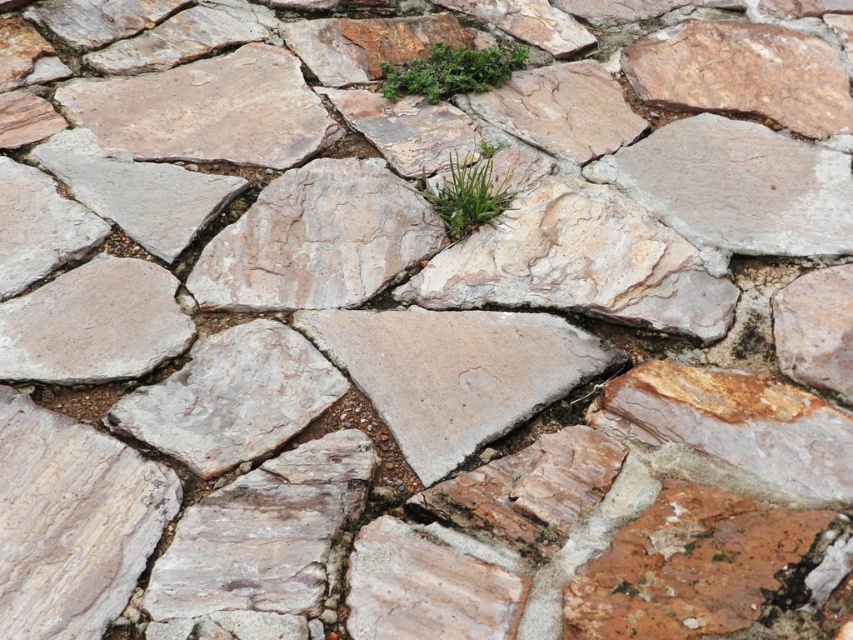
How much distance is there between green leafy plant at upper center and green leafy grass at center?

green leafy plant at upper center and green leafy grass at center are 48.25 centimeters apart.

Describe the element at coordinates (451, 72) in the screenshot. I see `green leafy plant at upper center` at that location.

Describe the element at coordinates (451, 72) in the screenshot. The width and height of the screenshot is (853, 640). I see `green leafy plant at upper center` at that location.

Find the location of a particular element. green leafy plant at upper center is located at coordinates (451, 72).